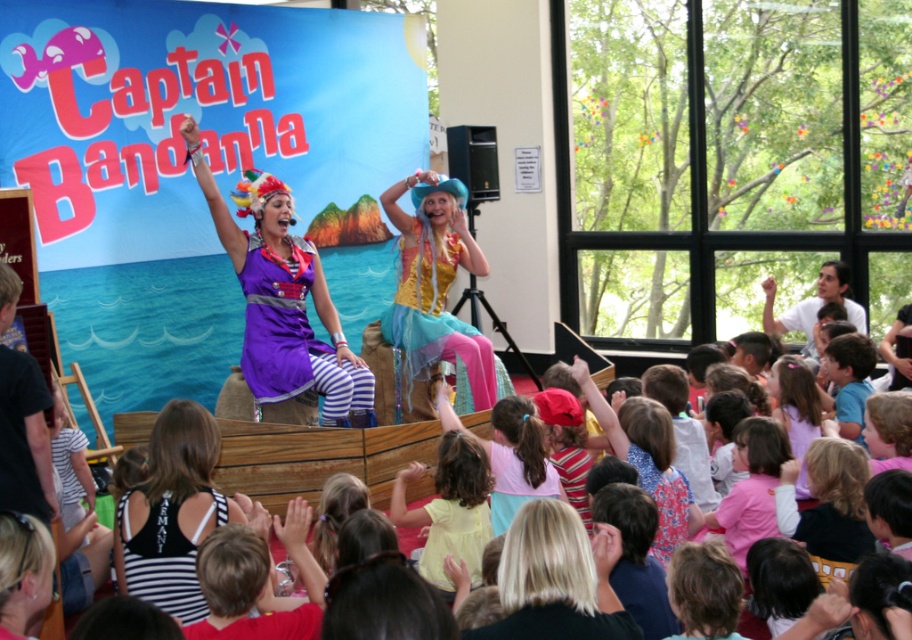
You are a photographer setting up for a photo shoot at the Captain Bandana performance. You need to ensure that the black striped tank top at lower left and the blonde hair at center are both visible in the frame. Based on their positions, which object should you adjust your camera angle to focus on first to include both in the shot?

The black striped tank top at lower left is positioned on the left side of blonde hair at center. To include both in the frame, adjust your camera angle to focus on the black striped tank top at lower left first, then ensure the blonde hair at center is visible to the right of it.

Looking at this image, you are designing a stage layout for a school play and need to place two performers wearing the purple satin dress at center and the yellow matte dress at center. Since the stage is narrow, you must ensure they can stand side by side without overlapping. Based on the image, which performer should you position wider apart to accommodate their costumes?

The purple satin dress at center has a larger width than the yellow matte dress at center, so you should position the performer in the purple satin dress at center wider apart to accommodate its larger size.